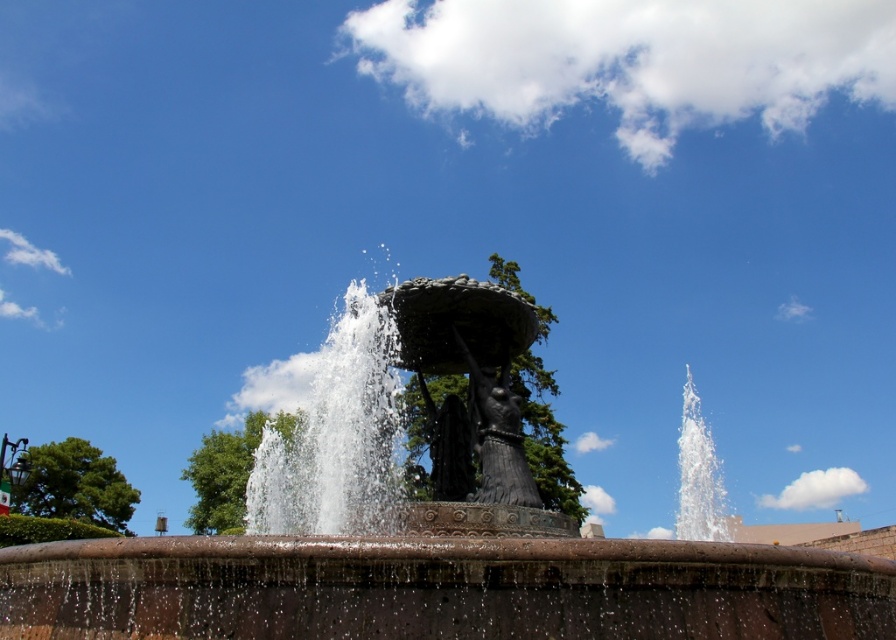
Is point (885, 573) positioned before point (506, 410)?

Yes.

Is the position of bronze statue at center less distant than that of black polished stone statue at center?

Yes.

The width and height of the screenshot is (896, 640). I want to click on bronze statue at center, so pyautogui.click(x=421, y=536).